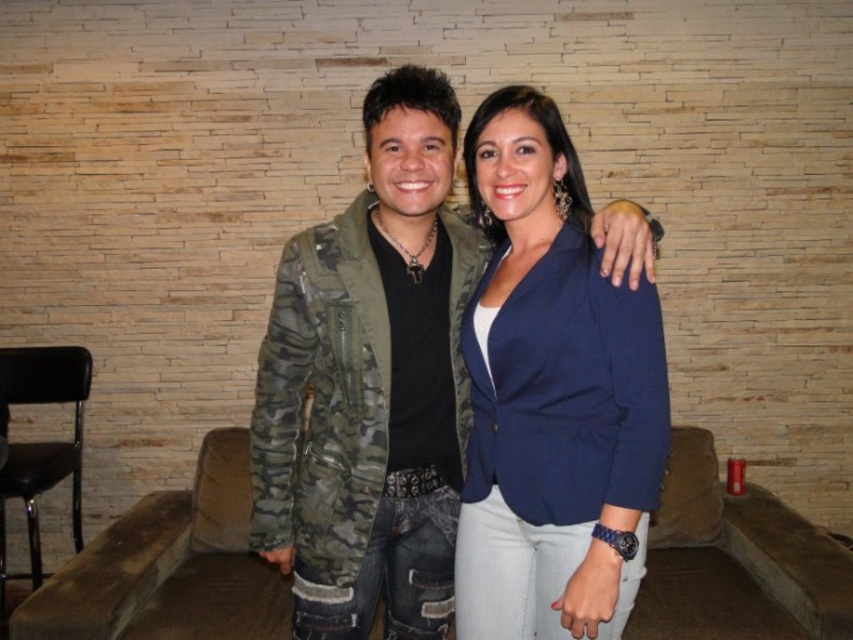
Does camo jacket at center have a greater width compared to navy blue blazer at center?

Correct, the width of camo jacket at center exceeds that of navy blue blazer at center.

Based on the photo, who is taller, camo jacket at center or navy blue blazer at center?

Answer: Standing taller between the two is camo jacket at center.

In order to click on camo jacket at center in this screenshot , I will do `click(370, 384)`.

You are a GUI agent. You are given a task and a screenshot of the screen. Output one action in this format:
    pyautogui.click(x=<x>, y=<y>)
    Task: Click on the camo jacket at center
    This screenshot has height=640, width=853.
    Given the screenshot: What is the action you would take?
    pyautogui.click(x=370, y=384)